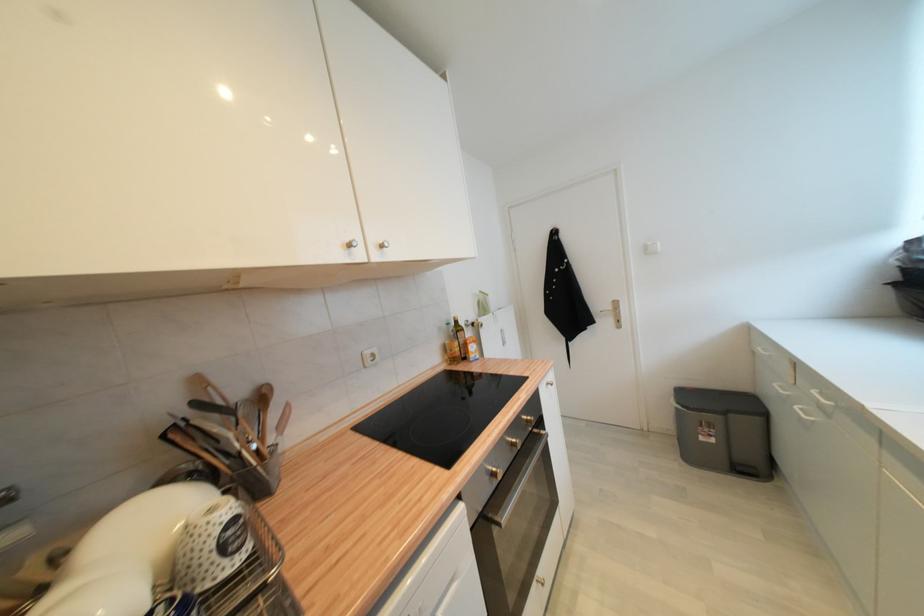
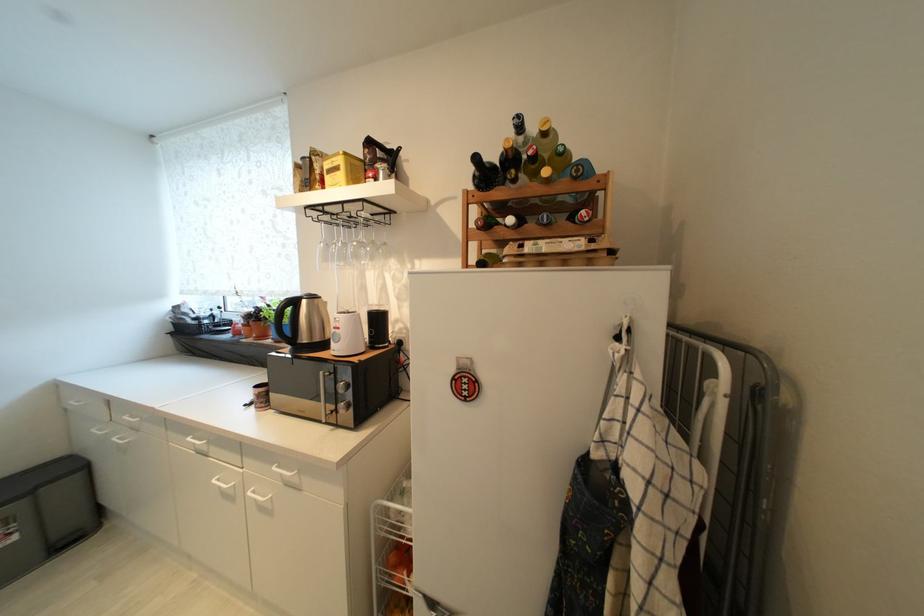
Question: The first image is from the beginning of the video and the second image is from the end. How did the camera likely rotate when shooting the video?

Choices:
 (A) Left
 (B) Right
 (C) Up
 (D) Down

Answer: (B)